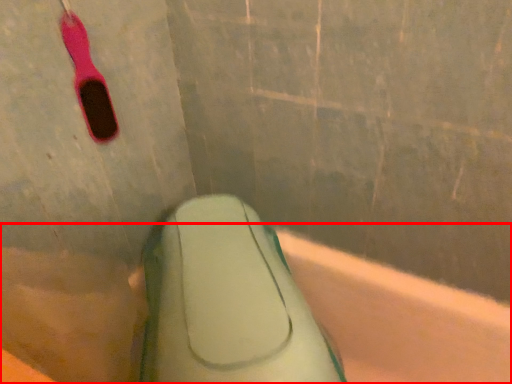
Question: Where is bath (annotated by the red box) located in relation to toothbrush in the image?

Choices:
 (A) left
 (B) right

Answer: (B)